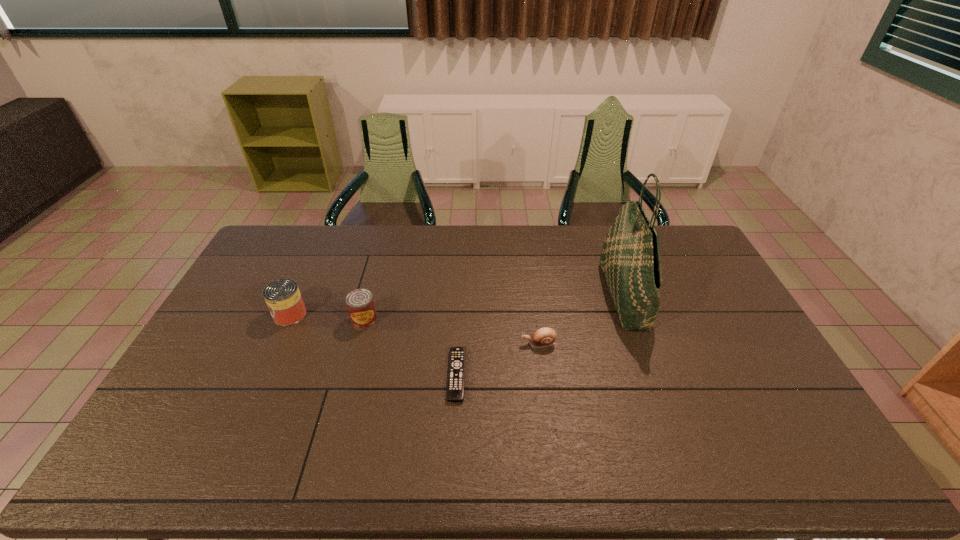
The width and height of the screenshot is (960, 540). Identify the location of free spot between the rightmost object and the leftmost object. (457, 305).

The image size is (960, 540). I want to click on vacant space in between the shortest object and the left can, so click(373, 345).

Where is `free space between the tote bag and the right can`? The width and height of the screenshot is (960, 540). free space between the tote bag and the right can is located at coordinates (494, 308).

Where is `free point between the third object from right to left and the escargot`? This screenshot has height=540, width=960. free point between the third object from right to left and the escargot is located at coordinates (498, 360).

The height and width of the screenshot is (540, 960). Identify the location of free space between the second object from right to left and the fourth object from right to left. (452, 332).

Locate an element on the screen. The width and height of the screenshot is (960, 540). free spot between the escargot and the left can is located at coordinates (415, 329).

The image size is (960, 540). I want to click on vacant area that lies between the nearest object and the left can, so click(x=373, y=345).

Locate an element on the screen. This screenshot has width=960, height=540. empty space between the second object from left to right and the tote bag is located at coordinates (494, 308).

Identify the location of object that is the fourth nearest to the shortest object. (282, 296).

The image size is (960, 540). I want to click on object that is the second nearest to the nearest object, so click(360, 303).